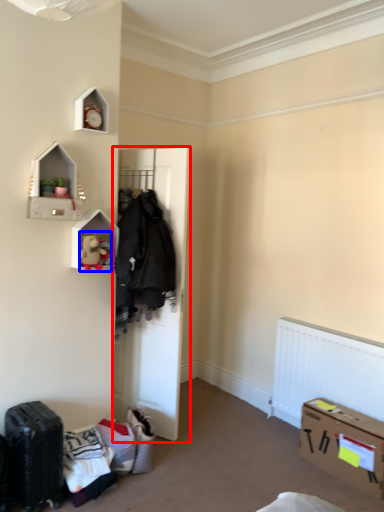
Question: Which point is closer to the camera, door (highlighted by a red box) or toy (highlighted by a blue box)?

Choices:
 (A) door
 (B) toy

Answer: (B)